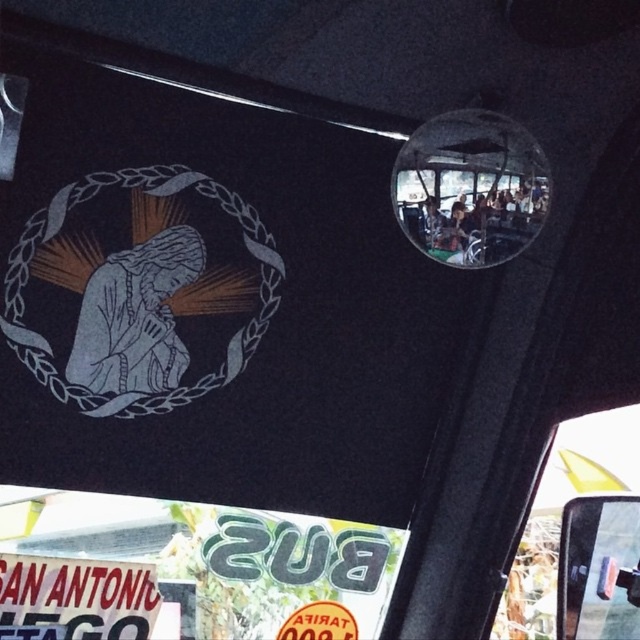
You are a passenger on a bus and want to know if you can reach both the matte silver emblem at center and the transparent glass window at lower right from your seat. The distance between them is 38.17 inches. If your arm can extend 36 inches, can you reach both objects without moving your seat?

The distance between the matte silver emblem at center and the transparent glass window at lower right is 38.17 inches. Since your arm can only extend 36 inches, you cannot reach both objects without moving your seat.

You are a passenger on a bus and notice two items above you. One is the matte silver emblem at center and the other is the white matte sign at lower left. Which of these items is taller?

The matte silver emblem at center has a greater height compared to the white matte sign at lower left, so the matte silver emblem at center is taller.

You are a passenger on the bus and want to take a photo of both the point at coordinates point[560,444] and point[68,568]. Which point will appear closer to the camera in the photo?

Point[68,568] will appear closer to the camera in the photo because it is physically closer to the camera than point[560,444].